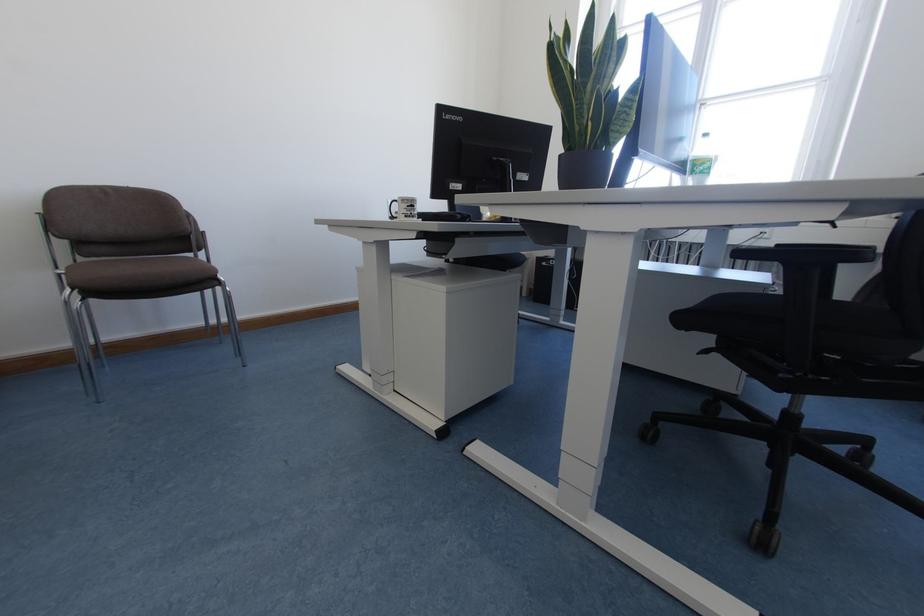
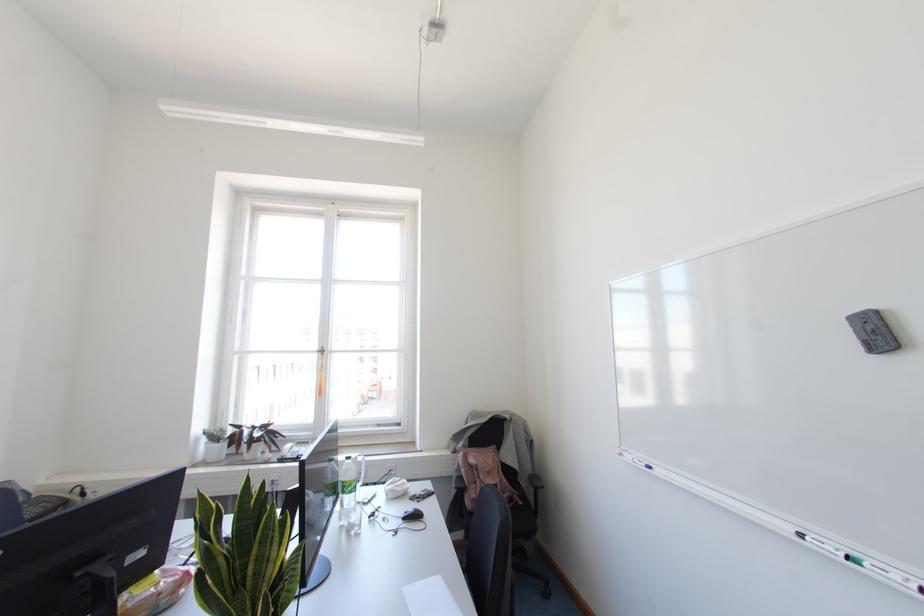
Locate, in the second image, the point that corresponds to (694,164) in the first image.

(343, 485)